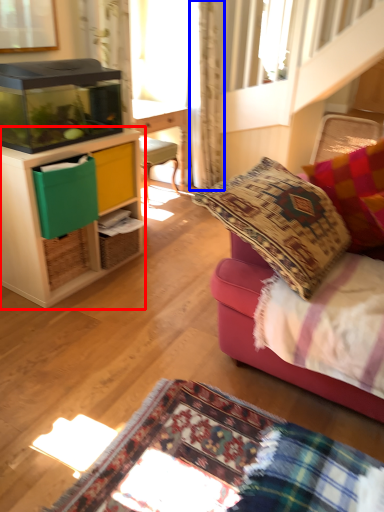
Question: Which object appears farthest to the camera in this image, cabinetry (highlighted by a red box) or curtain (highlighted by a blue box)?

Choices:
 (A) cabinetry
 (B) curtain

Answer: (B)